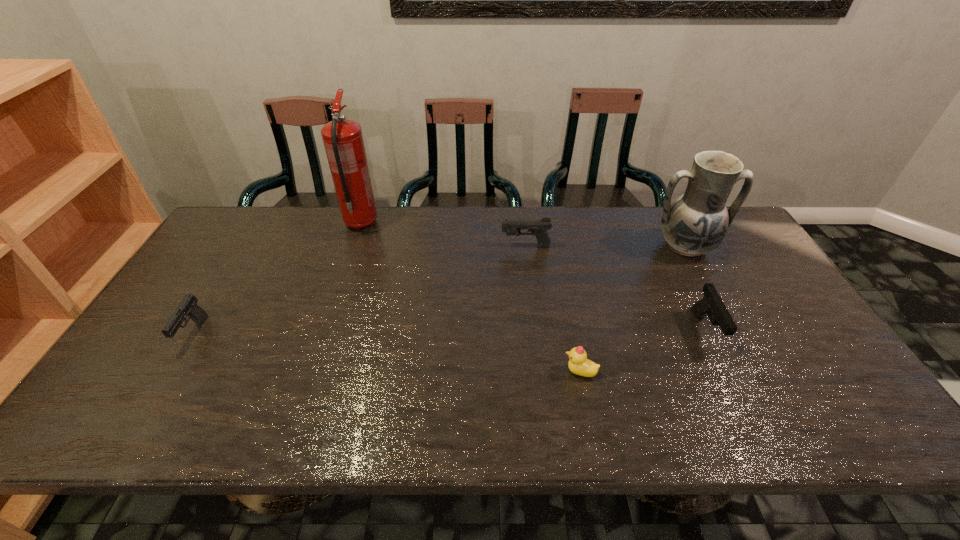
I want to click on vacant space situated at the barrel of the second pistol from left to right, so click(389, 246).

Where is `vacant space located at the barrel of the second pistol from left to right`? vacant space located at the barrel of the second pistol from left to right is located at coordinates (429, 246).

At what (x,y) coordinates should I click in order to perform the action: click on vacant space positioned on the front-facing side of the rightmost pistol. Please return your answer as a coordinate pair (x, y). Image resolution: width=960 pixels, height=540 pixels. Looking at the image, I should click on (751, 424).

In order to click on vacant space located 0.210m aim along the barrel of the shortest pistol in this screenshot , I will do `click(133, 434)`.

The width and height of the screenshot is (960, 540). In order to click on free space located on the front-facing side of the duckling in this screenshot , I will do `click(419, 372)`.

The image size is (960, 540). Find the location of `vacant region located 0.190m on the front-facing side of the duckling`. vacant region located 0.190m on the front-facing side of the duckling is located at coordinates (485, 372).

Locate an element on the screen. vacant space located on the front-facing side of the duckling is located at coordinates (501, 372).

This screenshot has width=960, height=540. I want to click on fire extinguisher that is at the far edge, so click(343, 141).

You are a GUI agent. You are given a task and a screenshot of the screen. Output one action in this format:
    pyautogui.click(x=<x>, y=<y>)
    Task: Click on the pitcher located at the far edge
    
    Given the screenshot: What is the action you would take?
    pyautogui.click(x=696, y=223)

Where is `pistol that is at the far edge`? The image size is (960, 540). pistol that is at the far edge is located at coordinates (538, 227).